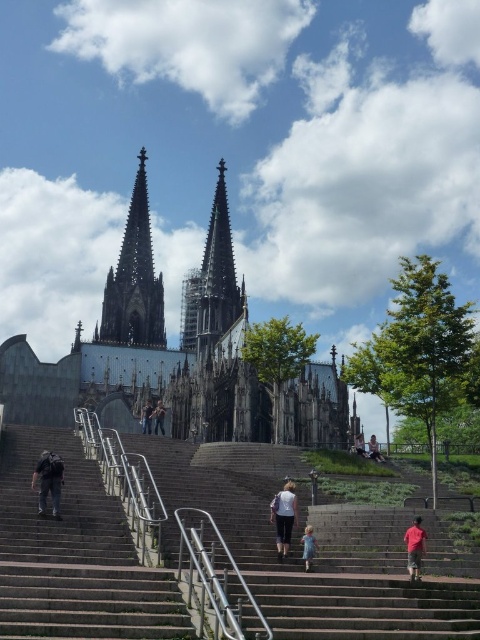
Between point (134, 292) and point (361, 440), which one is positioned in front?

Positioned in front is point (361, 440).

Is dark gray stone church at center taller than white cotton shirt at lower center?

Correct, dark gray stone church at center is much taller as white cotton shirt at lower center.

At what (x,y) coordinates should I click in order to perform the action: click on dark gray stone church at center. Please return your answer as a coordinate pair (x, y). Looking at the image, I should click on 176,355.

Is concrete stairs at left shorter than white cotton pants at center?

No, concrete stairs at left is not shorter than white cotton pants at center.

Does point (35, 444) lie behind point (296, 508)?

That is True.

Image resolution: width=480 pixels, height=640 pixels. Identify the location of concrete stairs at left. (74, 554).

Is point (216, 269) farther from camera compared to point (414, 564)?

Yes.

Can you confirm if dark gray stone spire at center is positioned below red cotton shirt at lower right?

No, dark gray stone spire at center is not below red cotton shirt at lower right.

Identify the location of dark gray stone spire at center. This screenshot has width=480, height=640. (212, 282).